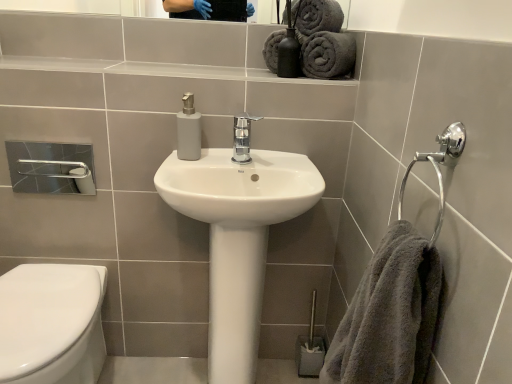
Question: Considering their positions, is white glossy toilet at lower left located in front of or behind clear glass mirror at upper center?

Choices:
 (A) behind
 (B) front

Answer: (B)

Question: Considering the positions of point (8, 377) and point (35, 4), is point (8, 377) closer or farther from the camera than point (35, 4)?

Choices:
 (A) closer
 (B) farther

Answer: (A)

Question: Estimate the real-world distances between objects in this image. Which object is farther from the dark gray plush towels at upper right, arranged as the second bath towel when viewed from the left?

Choices:
 (A) gray fluffy towel at right
 (B) gray fluffy towel at upper right, which ranks as the second bath towel in right-to-left order
 (C) clear glass mirror at upper center
 (D) chrome metallic faucet at center
 (E) white glossy toilet at lower left

Answer: (C)

Question: Considering the real-world distances, which object is closest to the chrome metallic faucet at center?

Choices:
 (A) metallic silver toilet brush at lower right
 (B) white glossy toilet at lower left
 (C) matte gray soap dispenser at center
 (D) dark gray plush towels at upper right, arranged as the second bath towel when viewed from the left
 (E) white glossy sink at center

Answer: (C)